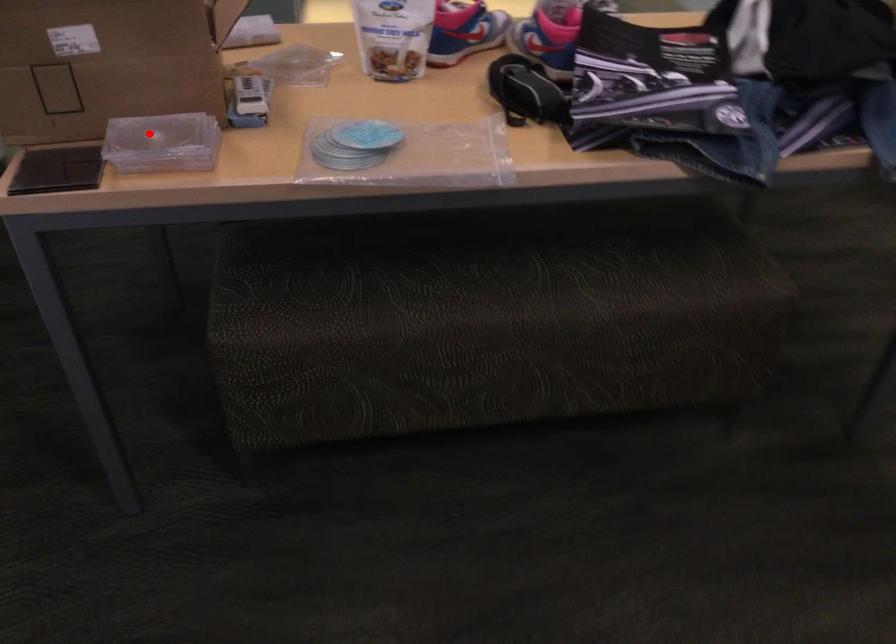
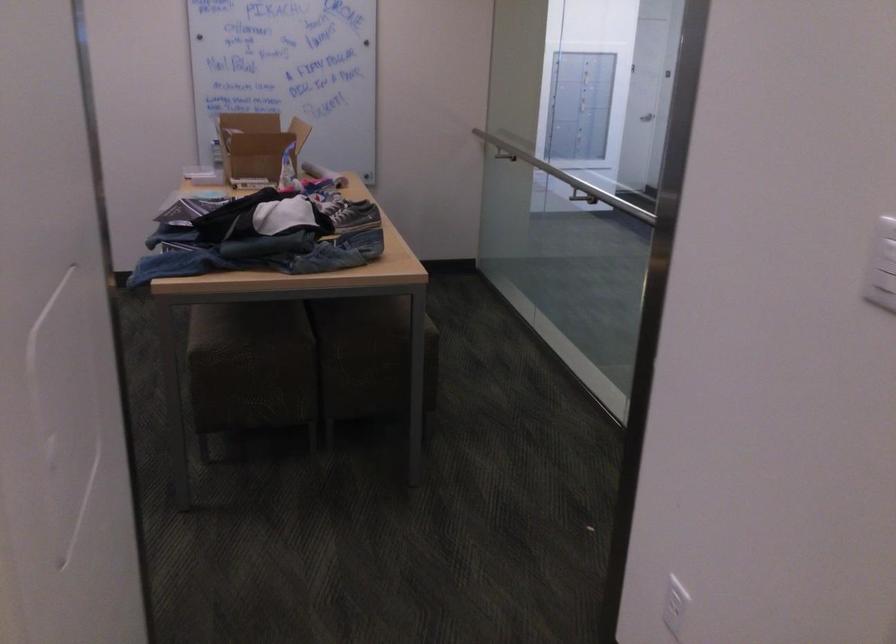
Question: I am providing you with two images of the same scene from different viewpoints. A red point is marked on the first image. Can you still see the location of the red point in image 2?

Choices:
 (A) Yes
 (B) No

Answer: (B)